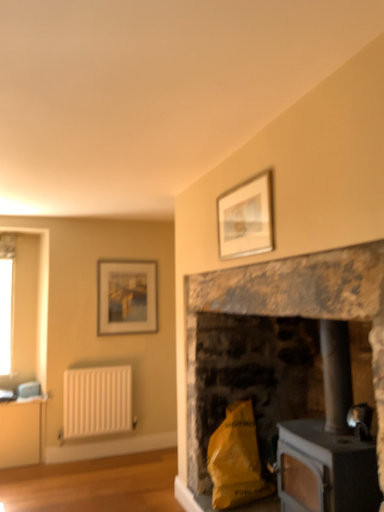
This screenshot has height=512, width=384. Describe the element at coordinates (328, 444) in the screenshot. I see `black matte wood burning stove at lower right` at that location.

The width and height of the screenshot is (384, 512). What do you see at coordinates (97, 401) in the screenshot?
I see `white textured radiator at left` at bounding box center [97, 401].

Measure the distance between point (71,387) and camera.

Point (71,387) is 4.07 meters away from camera.

The height and width of the screenshot is (512, 384). What do you see at coordinates (246, 218) in the screenshot?
I see `matte silver picture frame at upper center, the 1th picture frame when ordered from top to bottom` at bounding box center [246, 218].

At what (x,y) coordinates should I click in order to perform the action: click on black matte wood burning stove at lower right. Please return your answer as a coordinate pair (x, y). Looking at the image, I should click on (328, 444).

Can you confirm if rustic stone fireplace at center is positioned to the right of matte silver picture frame at upper center, the 2th picture frame viewed from the back?

Yes.

From the picture: Between rustic stone fireplace at center and matte silver picture frame at upper center, arranged as the second picture frame when viewed from the left, which one has larger width?

rustic stone fireplace at center is wider.

Which of these two, rustic stone fireplace at center or matte silver picture frame at upper center, which is the first picture frame from front to back, is bigger?

With larger size is rustic stone fireplace at center.

From a real-world perspective, is rustic stone fireplace at center under matte silver picture frame at upper center, the second picture frame when ordered from bottom to top?

Yes, from a real-world perspective, rustic stone fireplace at center is under matte silver picture frame at upper center, the second picture frame when ordered from bottom to top.

Looking at this image, can you tell me how much yellow paper bag at lower center and matte silver picture frame at upper center, which is the first picture frame from front to back, differ in facing direction?

The facing directions of yellow paper bag at lower center and matte silver picture frame at upper center, which is the first picture frame from front to back, are 3.96 degrees apart.

Considering the relative sizes of yellow paper bag at lower center and matte silver picture frame at upper center, the second picture frame when ordered from bottom to top, in the image provided, is yellow paper bag at lower center wider than matte silver picture frame at upper center, the second picture frame when ordered from bottom to top,?

Indeed, yellow paper bag at lower center has a greater width compared to matte silver picture frame at upper center, the second picture frame when ordered from bottom to top.

In order to click on material below the matte silver picture frame at upper center, arranged as the second picture frame when viewed from the left (from a real-world perspective) in this screenshot , I will do `click(236, 459)`.

Which object is closer to the camera taking this photo, matte wooden picture frame at upper left, acting as the first picture frame starting from the left, or rustic stone fireplace at center?

rustic stone fireplace at center is in front.

There is a rustic stone fireplace at center. In order to click on the 1st picture frame above it (from a real-world perspective) in this screenshot , I will do `click(127, 297)`.

Which of these two, matte wooden picture frame at upper left, the 2th picture frame from the right, or rustic stone fireplace at center, is thinner?

matte wooden picture frame at upper left, the 2th picture frame from the right.

Is matte wooden picture frame at upper left, acting as the first picture frame starting from the left, in contact with rustic stone fireplace at center?

matte wooden picture frame at upper left, acting as the first picture frame starting from the left, is not next to rustic stone fireplace at center, and they're not touching.

Which is nearer, (x=126, y=266) or (x=267, y=492)?

The point (x=267, y=492) is closer to the camera.

From a real-world perspective, who is located higher, matte wooden picture frame at upper left, acting as the first picture frame starting from the left, or yellow paper bag at lower center?

In real-world perspective, matte wooden picture frame at upper left, acting as the first picture frame starting from the left, is above.

Identify the location of the 1st picture frame above the yellow paper bag at lower center (from the image's perspective). Image resolution: width=384 pixels, height=512 pixels. (127, 297).

Is yellow paper bag at lower center at the back of matte wooden picture frame at upper left, which appears as the first picture frame when viewed from the back?

No, yellow paper bag at lower center is not at the back of matte wooden picture frame at upper left, which appears as the first picture frame when viewed from the back.

Are matte wooden picture frame at upper left, which appears as the first picture frame when viewed from the back, and white textured radiator at left beside each other?

No, matte wooden picture frame at upper left, which appears as the first picture frame when viewed from the back, is not touching white textured radiator at left.

Could you tell me if matte wooden picture frame at upper left, marked as the second picture frame in a top-to-bottom arrangement, is facing white textured radiator at left?

No, matte wooden picture frame at upper left, marked as the second picture frame in a top-to-bottom arrangement, is not facing towards white textured radiator at left.

Which is correct: matte wooden picture frame at upper left, acting as the first picture frame starting from the left, is inside white textured radiator at left, or outside of it?

matte wooden picture frame at upper left, acting as the first picture frame starting from the left, is outside white textured radiator at left.

Can you tell me how much rustic stone fireplace at center and white textured radiator at left differ in facing direction?

They differ by 91.8 degrees in their facing directions.

Does point (296, 340) come farther from viewer compared to point (94, 409)?

That is False.

From a real-world perspective, which is physically below, rustic stone fireplace at center or white textured radiator at left?

white textured radiator at left is physically lower.

Looking at their sizes, would you say rustic stone fireplace at center is wider or thinner than white textured radiator at left?

Considering their sizes, rustic stone fireplace at center looks broader than white textured radiator at left.

Considering the sizes of objects black matte wood burning stove at lower right and yellow paper bag at lower center in the image provided, who is smaller, black matte wood burning stove at lower right or yellow paper bag at lower center?

Smaller between the two is yellow paper bag at lower center.

From a real-world perspective, is black matte wood burning stove at lower right positioned over yellow paper bag at lower center based on gravity?

Yes.

Is black matte wood burning stove at lower right to the right of yellow paper bag at lower center from the viewer's perspective?

Yes.

What are the coordinates of `fireplace located underneath the matte silver picture frame at upper center, the second picture frame when ordered from bottom to top (from a real-world perspective)` in the screenshot? It's located at (274, 341).

Locate an element on the screen. Image resolution: width=384 pixels, height=512 pixels. the 1st picture frame to the left when counting from the yellow paper bag at lower center is located at coordinates (246, 218).

From the image, which object appears to be farther from white textured radiator at left, black matte wood burning stove at lower right or matte wooden picture frame at upper left, positioned as the 1th picture frame in bottom-to-top order?

black matte wood burning stove at lower right is further to white textured radiator at left.

Considering their positions, is white textured radiator at left positioned closer to rustic stone fireplace at center than black matte wood burning stove at lower right?

Among the two, black matte wood burning stove at lower right is located nearer to rustic stone fireplace at center.

When comparing their distances from matte wooden picture frame at upper left, positioned as the 1th picture frame in bottom-to-top order, does rustic stone fireplace at center or yellow paper bag at lower center seem closer?

rustic stone fireplace at center lies closer to matte wooden picture frame at upper left, positioned as the 1th picture frame in bottom-to-top order, than the other object.

Based on their spatial positions, is matte silver picture frame at upper center, the 1th picture frame when ordered from top to bottom, or rustic stone fireplace at center further from black matte wood burning stove at lower right?

matte silver picture frame at upper center, the 1th picture frame when ordered from top to bottom, is positioned further to the anchor black matte wood burning stove at lower right.

Looking at this image, which object lies nearer to the anchor point matte silver picture frame at upper center, the 2th picture frame viewed from the back, black matte wood burning stove at lower right or matte wooden picture frame at upper left, marked as the second picture frame in a top-to-bottom arrangement?

black matte wood burning stove at lower right is positioned closer to the anchor matte silver picture frame at upper center, the 2th picture frame viewed from the back.

Looking at the image, which one is located further to yellow paper bag at lower center, matte silver picture frame at upper center, the 2th picture frame viewed from the back, or black matte wood burning stove at lower right?

matte silver picture frame at upper center, the 2th picture frame viewed from the back.

Based on their spatial positions, is yellow paper bag at lower center or rustic stone fireplace at center further from white textured radiator at left?

rustic stone fireplace at center is positioned further to the anchor white textured radiator at left.

Based on their spatial positions, is white textured radiator at left or black matte wood burning stove at lower right further from yellow paper bag at lower center?

white textured radiator at left.

Identify the location of picture frame between rustic stone fireplace at center and white textured radiator at left from front to back. (246, 218).

This screenshot has width=384, height=512. I want to click on material between rustic stone fireplace at center and white textured radiator at left in the front-back direction, so click(236, 459).

Locate an element on the screen. radiator between black matte wood burning stove at lower right and matte wooden picture frame at upper left, the second picture frame from the front, along the z-axis is located at coordinates (97, 401).

Locate an element on the screen. The image size is (384, 512). material positioned between black matte wood burning stove at lower right and matte wooden picture frame at upper left, which appears as the first picture frame when viewed from the back, from near to far is located at coordinates point(236,459).